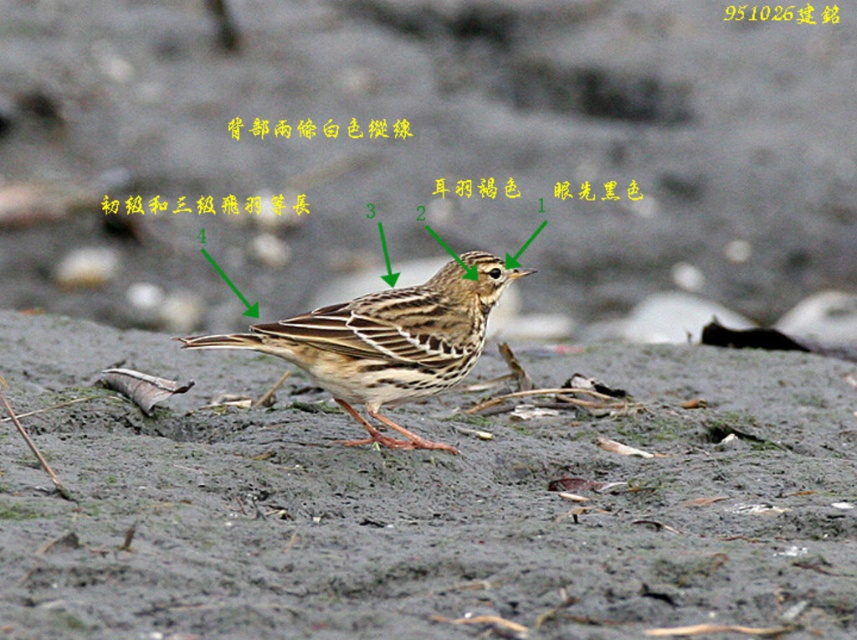
From the picture: You are a photographer trying to focus on the two points on the bird. Which point is closer to your camera, point (147, 362) or point (331, 332)?

Point (147, 362) is further to the camera than point (331, 332), so the closer point to your camera is point (331, 332).

You are a field researcher observing the bird in the image. You need to collect a sample of the mud from the ground where the bird is standing. The coordinates provided are point [424,500]. Can you confirm if the mud at that point is located directly under the bird?

The point [424,500] is at the center of the image, while the bird is standing on the ground surface described as a mix of soil and scattered debris. Since the bird is on the ground, the mud at point [424,500] is likely directly under the bird.

You are a nature photographer aiming to capture the brown speckled bird at center without disturbing it. Since the bird is standing on the brown matte mud at center, which surface should you avoid stepping on to prevent scaring it away?

The brown matte mud at center is positioned under the brown speckled bird at center, so you should avoid stepping on the brown matte mud at center to prevent scaring the bird away.